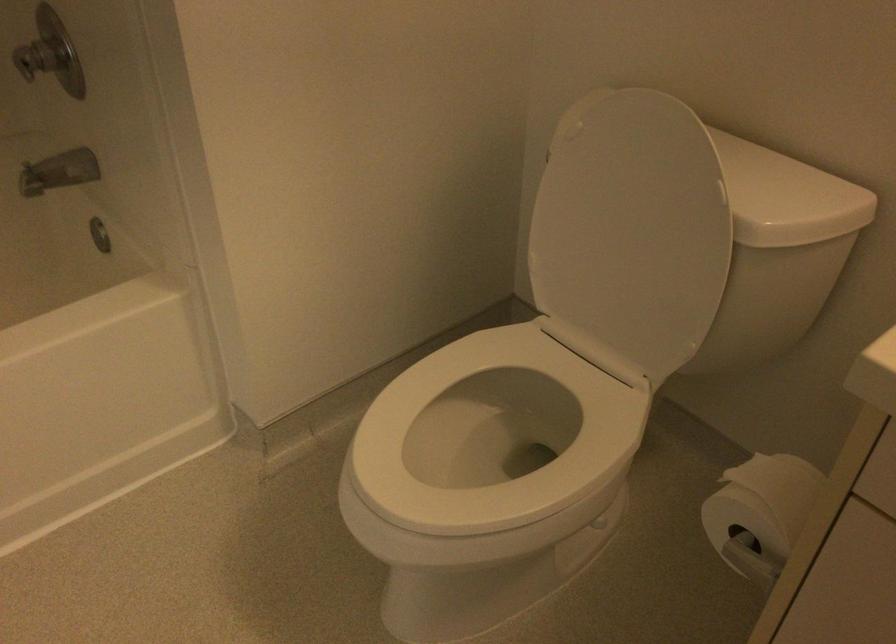
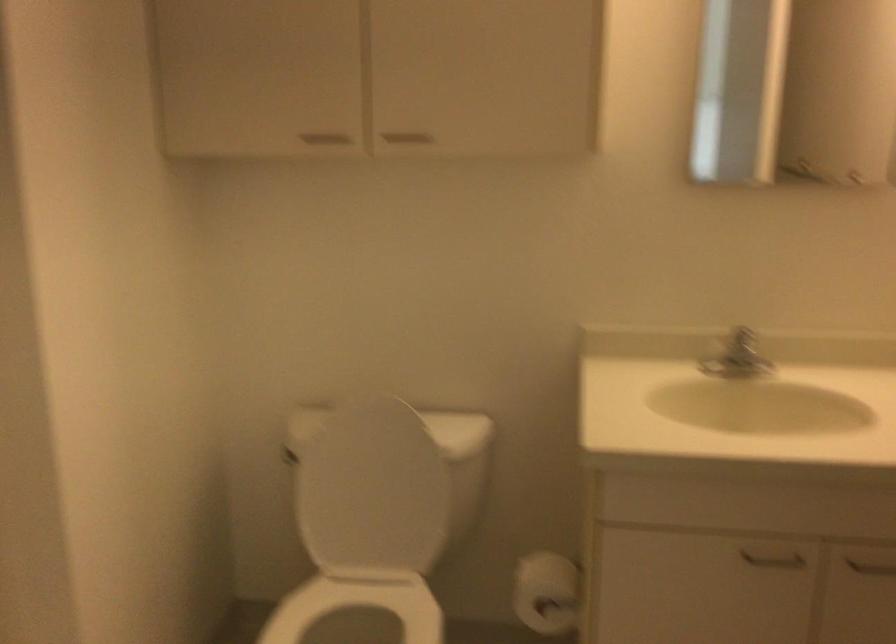
The images are taken continuously from a first-person perspective. In which direction is your viewpoint rotating?

The camera rotated toward right-up.